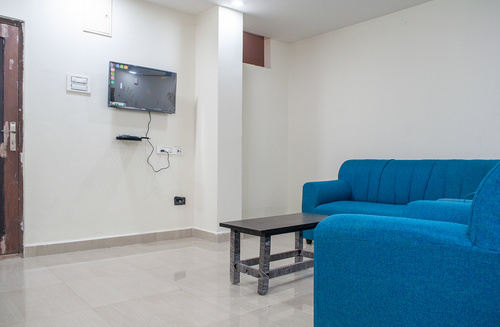
Image resolution: width=500 pixels, height=327 pixels. I want to click on chair, so click(419, 265).